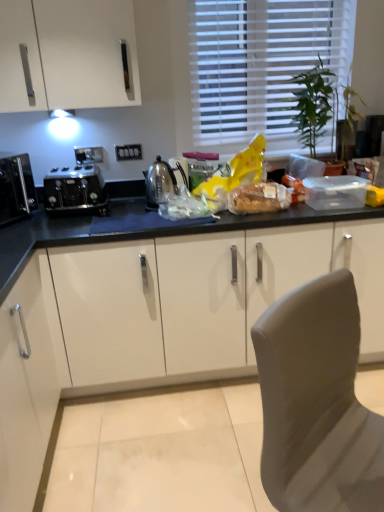
Question: Is matte brown bread at center, which is the 1th food in right-to-left order, aimed at black glossy microwave at left, marked as the 2th kitchen appliance in a right-to-left arrangement?

Choices:
 (A) yes
 (B) no

Answer: (B)

Question: Is matte brown bread at center, which is the 1th food in right-to-left order, taller than black glossy microwave at left, marked as the 2th kitchen appliance in a right-to-left arrangement?

Choices:
 (A) yes
 (B) no

Answer: (B)

Question: Can you confirm if matte brown bread at center, which is the 1th food in right-to-left order, is positioned to the left of black glossy microwave at left, marked as the 2th kitchen appliance in a right-to-left arrangement?

Choices:
 (A) no
 (B) yes

Answer: (A)

Question: From a real-world perspective, is matte brown bread at center, positioned as the second food in left-to-right order, physically below black glossy microwave at left, the 1th kitchen appliance viewed from the left?

Choices:
 (A) no
 (B) yes

Answer: (B)

Question: Is matte brown bread at center, positioned as the second food in left-to-right order, facing away from black glossy microwave at left, marked as the 2th kitchen appliance in a right-to-left arrangement?

Choices:
 (A) yes
 (B) no

Answer: (B)

Question: Does matte brown bread at center, positioned as the second food in left-to-right order, have a lesser height compared to black glossy microwave at left, the 1th kitchen appliance viewed from the left?

Choices:
 (A) no
 (B) yes

Answer: (B)

Question: Does black metallic toaster at left, which appears as the first kitchen appliance when viewed from the right, have a lesser width compared to satin silver kettle at center?

Choices:
 (A) yes
 (B) no

Answer: (B)

Question: Considering the relative positions of black metallic toaster at left, the second kitchen appliance positioned from the left, and satin silver kettle at center in the image provided, is black metallic toaster at left, the second kitchen appliance positioned from the left, to the left of satin silver kettle at center from the viewer's perspective?

Choices:
 (A) yes
 (B) no

Answer: (A)

Question: Is the position of black metallic toaster at left, the second kitchen appliance positioned from the left, less distant than that of satin silver kettle at center?

Choices:
 (A) yes
 (B) no

Answer: (A)

Question: Is black metallic toaster at left, which appears as the first kitchen appliance when viewed from the right, outside of satin silver kettle at center?

Choices:
 (A) yes
 (B) no

Answer: (A)

Question: Is black metallic toaster at left, the second kitchen appliance positioned from the left, aimed at satin silver kettle at center?

Choices:
 (A) no
 (B) yes

Answer: (A)

Question: Is black metallic toaster at left, the second kitchen appliance positioned from the left, next to satin silver kettle at center?

Choices:
 (A) no
 (B) yes

Answer: (A)

Question: Can you confirm if matte brown bread at center, which is the 1th food in right-to-left order, is positioned to the right of white blinds at upper center?

Choices:
 (A) no
 (B) yes

Answer: (A)